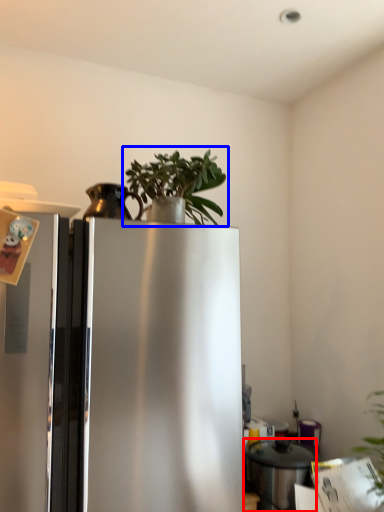
Question: Which object is closer to the camera taking this photo, appliance (highlighted by a red box) or houseplant (highlighted by a blue box)?

Choices:
 (A) appliance
 (B) houseplant

Answer: (B)